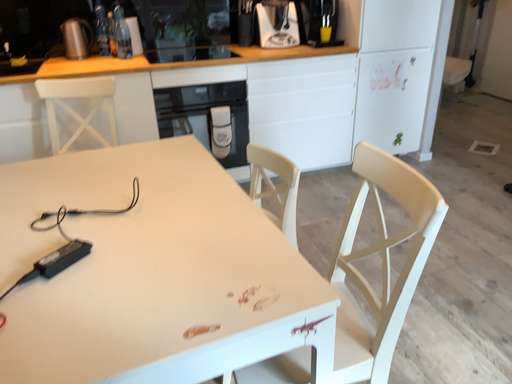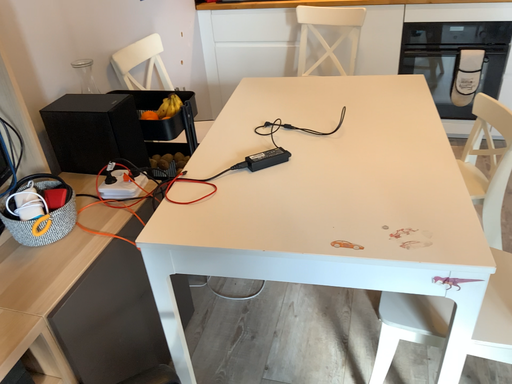
Question: Which way did the camera rotate in the video?

Choices:
 (A) rotated left
 (B) rotated right

Answer: (A)